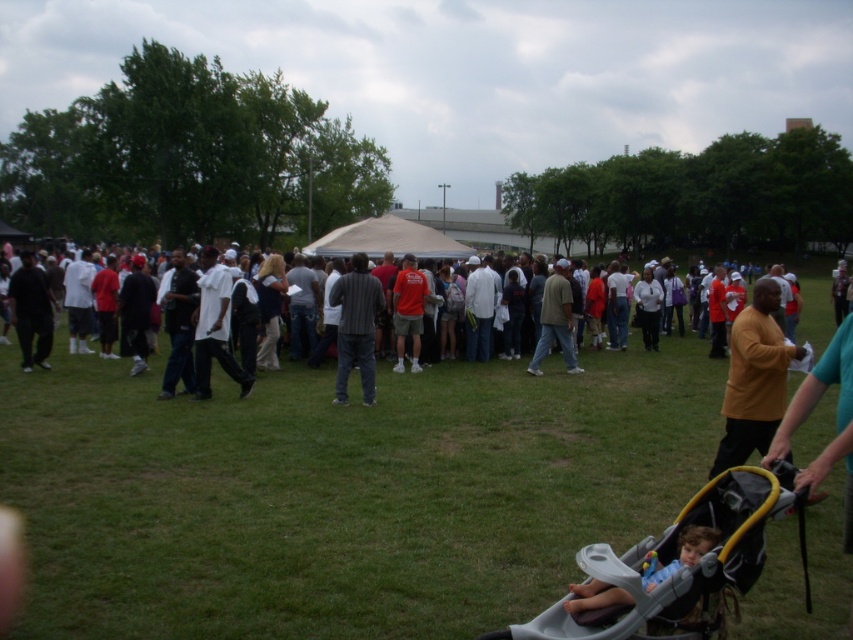
Which is behind, point (303, 518) or point (187, 292)?

Point (187, 292)

Can you confirm if green grass at center is taller than dark gray jeans at center?

In fact, green grass at center may be shorter than dark gray jeans at center.

Who is more distant from viewer, (x=476, y=621) or (x=180, y=337)?

Point (x=180, y=337)

You are a GUI agent. You are given a task and a screenshot of the screen. Output one action in this format:
    pyautogui.click(x=<x>, y=<y>)
    Task: Click on the green grass at center
    
    Given the screenshot: What is the action you would take?
    pyautogui.click(x=341, y=492)

At what (x,y) coordinates should I click in order to perform the action: click on light brown plush stroller at lower right. Please return your answer as a coordinate pair (x, y). The height and width of the screenshot is (640, 853). Looking at the image, I should click on (677, 556).

Is point (683, 560) farther from camera compared to point (136, 330)?

No, it is in front of (136, 330).

Does point (695, 536) come closer to viewer compared to point (129, 272)?

Yes, point (695, 536) is closer to viewer.

Find the location of a particular element. light brown plush stroller at lower right is located at coordinates (677, 556).

Does white matte coat at center have a lesser width compared to white cotton shirt at left?

Correct, white matte coat at center's width is less than white cotton shirt at left's.

Which is in front, point (480, 272) or point (88, 294)?

Positioned in front is point (480, 272).

What do you see at coordinates (479, 308) in the screenshot?
I see `white matte coat at center` at bounding box center [479, 308].

Locate an element on the screen. This screenshot has height=640, width=853. white matte coat at center is located at coordinates (479, 308).